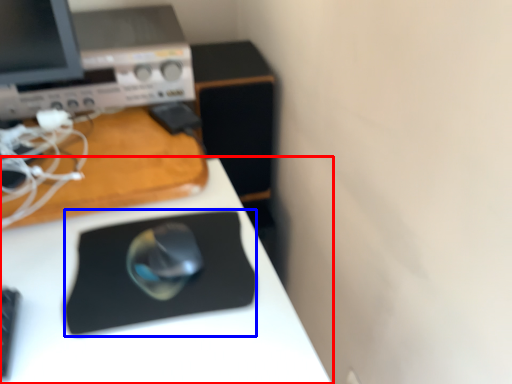
Question: Which object appears closest to the camera in this image, desk (highlighted by a red box) or mousepad (highlighted by a blue box)?

Choices:
 (A) desk
 (B) mousepad

Answer: (A)